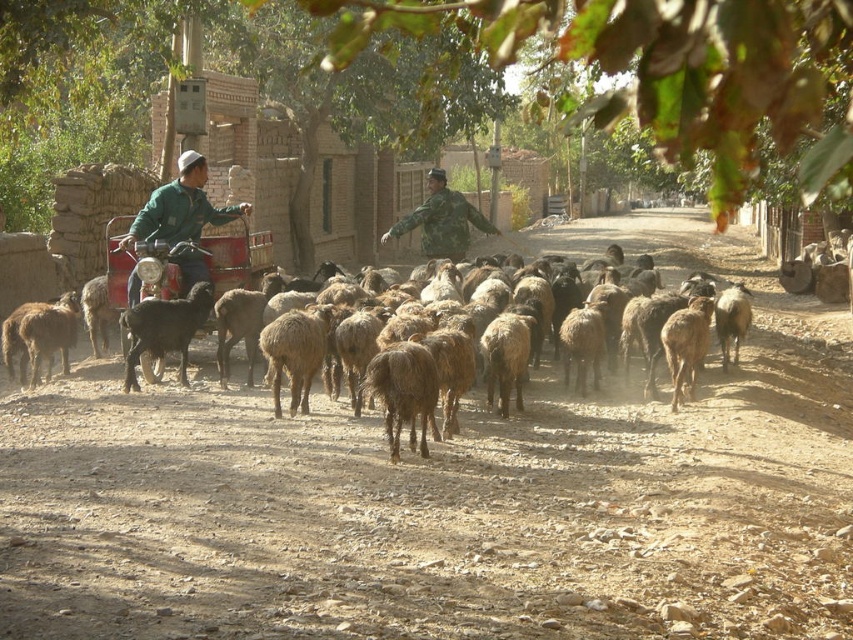
Based on the photo, who is positioned more to the right, brown dusty dirt track at center or black woolen goat at left?

brown dusty dirt track at center

Who is more distant from viewer, (440, 550) or (193, 289)?

Positioned behind is point (193, 289).

Find the location of a particular element. brown dusty dirt track at center is located at coordinates (433, 513).

From the picture: Can you confirm if metallic red cart at left is smaller than black woolen goat at left?

Correct, metallic red cart at left occupies less space than black woolen goat at left.

Which is more to the left, metallic red cart at left or black woolen goat at left?

metallic red cart at left is more to the left.

Where is `metallic red cart at left`? The height and width of the screenshot is (640, 853). metallic red cart at left is located at coordinates (236, 253).

Can you confirm if fuzzy woolen sheep at center is positioned above black woolen goat at left?

No, fuzzy woolen sheep at center is not above black woolen goat at left.

Is point (44, 456) positioned behind point (181, 348)?

No, (44, 456) is in front of (181, 348).

Does point (114, 458) come closer to viewer compared to point (175, 339)?

That is True.

Image resolution: width=853 pixels, height=640 pixels. I want to click on fuzzy woolen sheep at center, so click(x=178, y=426).